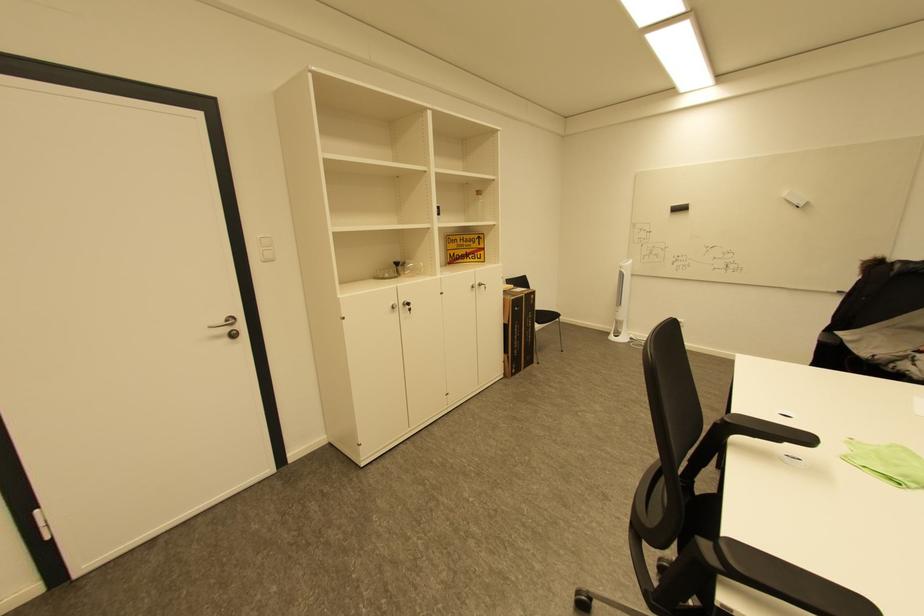
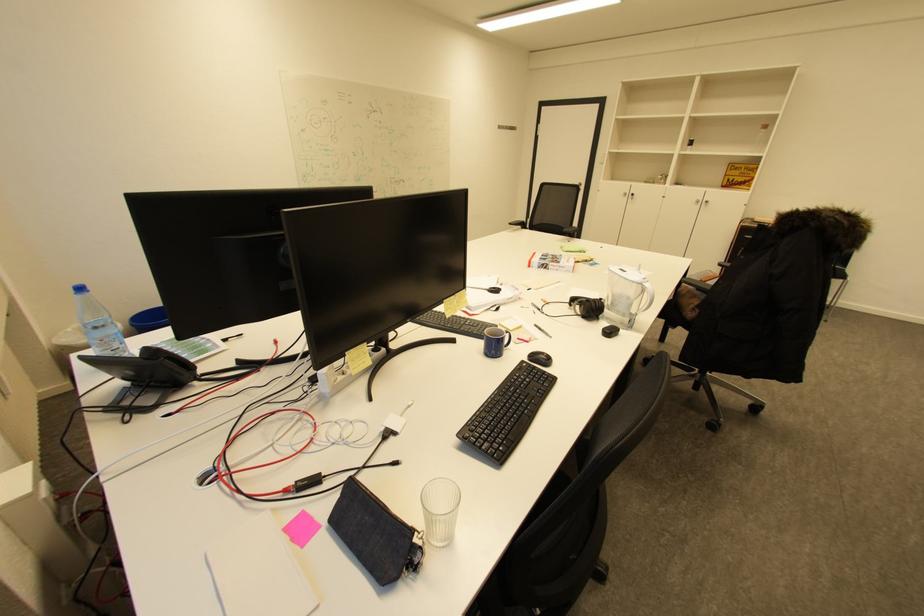
Where in the second image is the point corresponding to (x=479, y=286) from the first image?

(703, 201)